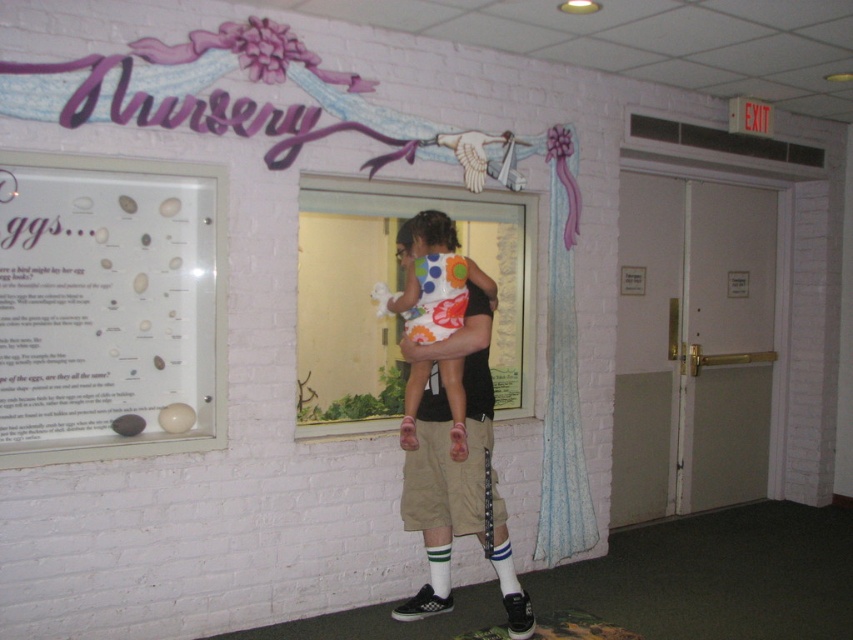
Question: Is matte glass display case at left positioned at the back of polka dot fabric dress at center?

Choices:
 (A) yes
 (B) no

Answer: (B)

Question: Is matte glass display case at left to the left of khaki shorts at center from the viewer's perspective?

Choices:
 (A) no
 (B) yes

Answer: (B)

Question: Is khaki shorts at center below polka dot fabric dress at center?

Choices:
 (A) no
 (B) yes

Answer: (B)

Question: Which of these objects is positioned closest to the matte glass display case at left?

Choices:
 (A) polka dot fabric dress at center
 (B) khaki shorts at center

Answer: (A)

Question: Which of the following is the closest to the observer?

Choices:
 (A) (212, 428)
 (B) (428, 369)
 (C) (448, 547)

Answer: (A)

Question: Considering the real-world distances, which object is farthest from the polka dot fabric dress at center?

Choices:
 (A) khaki shorts at center
 (B) matte glass display case at left

Answer: (B)